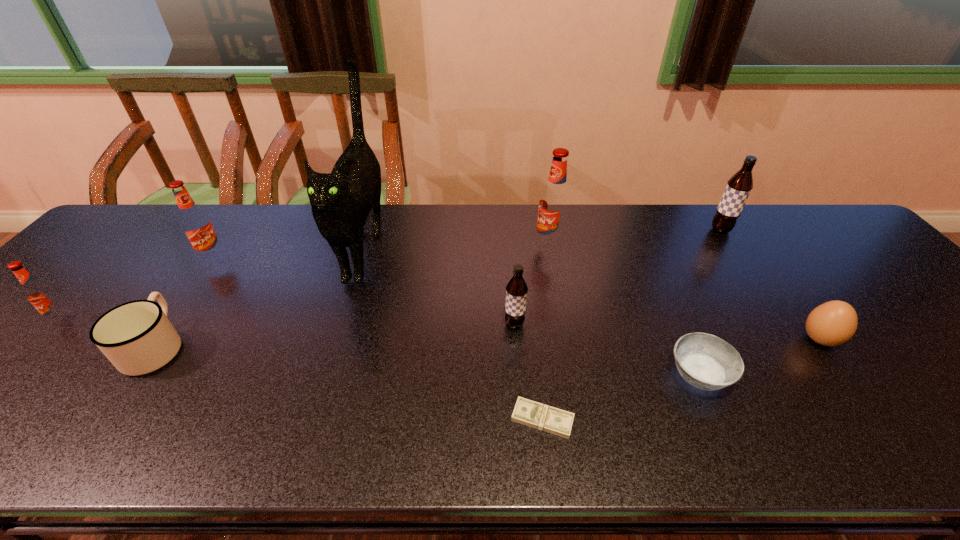
Where is `free spot located on the front of the bigger brown root beer`? free spot located on the front of the bigger brown root beer is located at coordinates (777, 312).

You are a GUI agent. You are given a task and a screenshot of the screen. Output one action in this format:
    pyautogui.click(x=<x>, y=<y>)
    Task: Click on the blank space located on the right of the nearest red root beer
    This screenshot has height=540, width=960.
    Given the screenshot: What is the action you would take?
    pyautogui.click(x=165, y=320)

Locate an element on the screen. vacant position located on the front of the smaller brown root beer is located at coordinates (519, 390).

What are the coordinates of `free spot located on the back of the boiled egg` in the screenshot? It's located at (741, 234).

Where is `vacant region located 0.270m on the side of the mug with the handle`? This screenshot has width=960, height=540. vacant region located 0.270m on the side of the mug with the handle is located at coordinates (223, 250).

Find the location of a particular element. free space located on the side of the mug with the handle is located at coordinates (231, 237).

In order to click on free space located on the side of the mug with the handle in this screenshot , I will do pyautogui.click(x=191, y=296).

The image size is (960, 540). What are the coordinates of `vacant space located 0.090m on the left of the eighth object from left to right` in the screenshot? It's located at click(626, 375).

The image size is (960, 540). In order to click on vacant region located on the left of the shortest object in this screenshot , I will do `click(385, 419)`.

Identify the location of cat that is at the far edge. (341, 201).